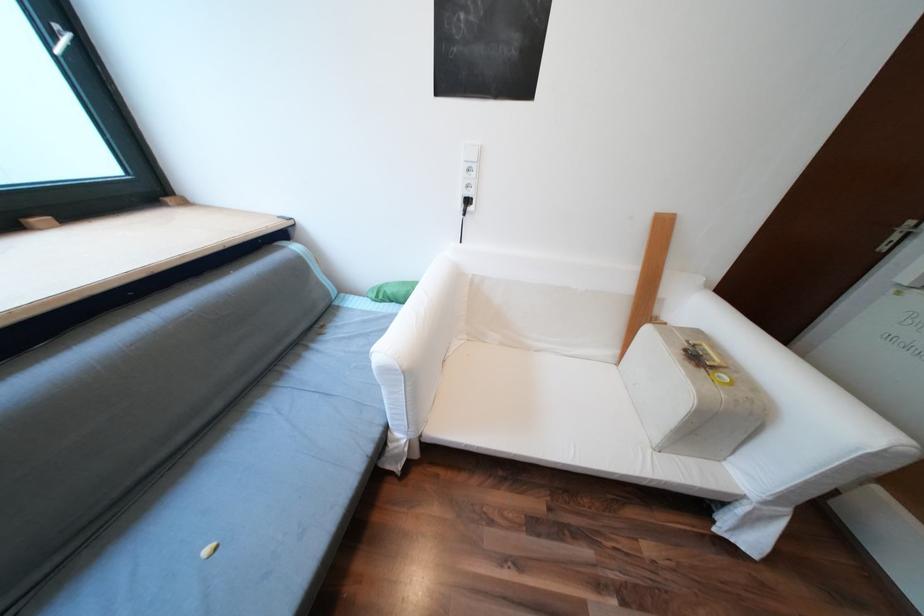
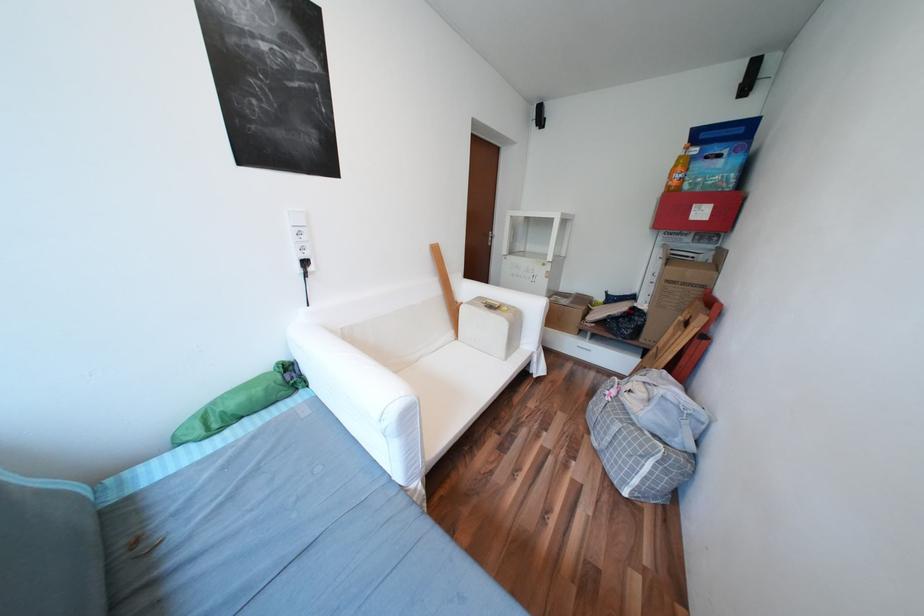
Question: The camera is either moving clockwise (left) or counter-clockwise (right) around the object. The first image is from the beginning of the video and the second image is from the end. Is the camera moving left or right when shooting the video?

Choices:
 (A) Left
 (B) Right

Answer: (A)